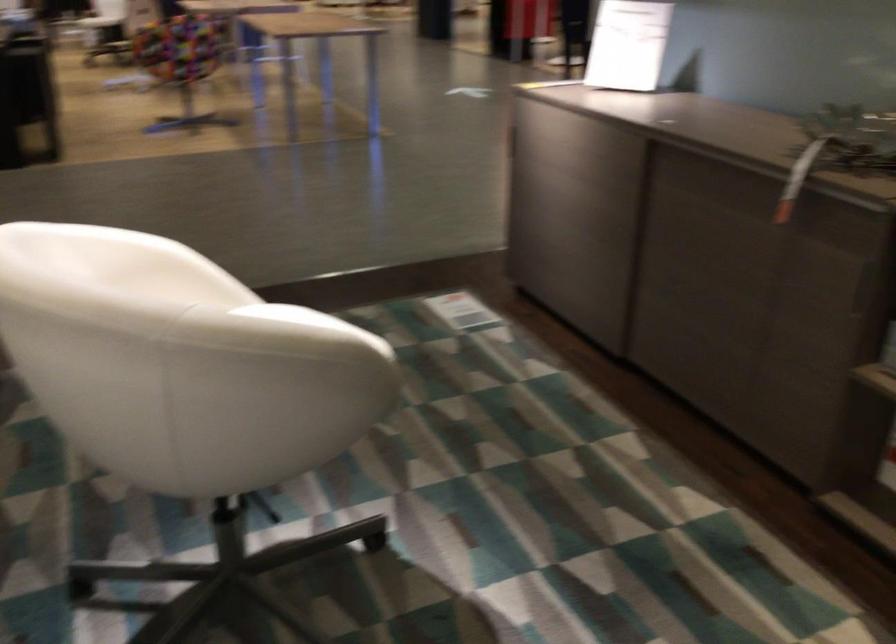
Describe the element at coordinates (307, 321) in the screenshot. I see `the white chair sitting surface` at that location.